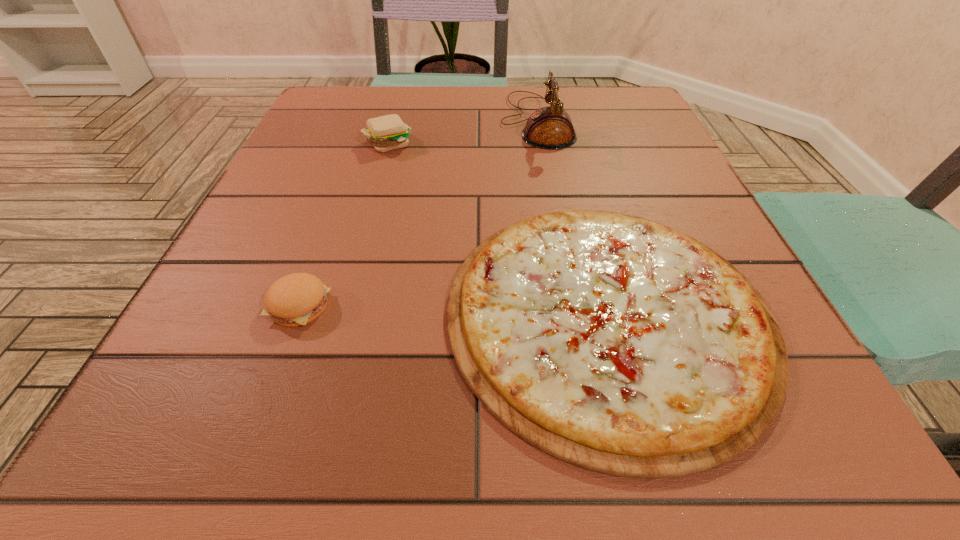
The image size is (960, 540). In the image, there is a desktop. What are the coordinates of `vacant region at the left edge` in the screenshot? It's located at (301, 240).

Locate an element on the screen. The width and height of the screenshot is (960, 540). free space at the right edge is located at coordinates (642, 185).

The image size is (960, 540). In the image, there is a desktop. Find the location of `vacant space at the far left corner`. vacant space at the far left corner is located at coordinates (373, 110).

The image size is (960, 540). In order to click on free space at the far right corner in this screenshot , I will do `click(568, 86)`.

The height and width of the screenshot is (540, 960). I want to click on free space between the shorter patty and the farther patty, so click(x=344, y=224).

At what (x,y) coordinates should I click in order to perform the action: click on free area in between the taller patty and the shortest object. Please return your answer as a coordinate pair (x, y). Looking at the image, I should click on (498, 228).

Where is `unoccupied area between the pizza and the third shortest object`? This screenshot has width=960, height=540. unoccupied area between the pizza and the third shortest object is located at coordinates pos(498,228).

In order to click on vacant point located between the farther patty and the shortest object in this screenshot , I will do `click(498, 228)`.

The width and height of the screenshot is (960, 540). Find the location of `vacant region between the taller patty and the nearer patty`. vacant region between the taller patty and the nearer patty is located at coordinates (344, 224).

This screenshot has height=540, width=960. Find the location of `object that is the second nearest to the telephone`. object that is the second nearest to the telephone is located at coordinates (617, 344).